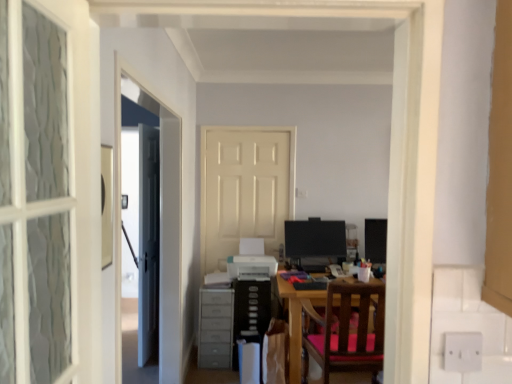
Question: Do you think wooden chair with pink cushion at center is within matte black monitor at right, which is counted as the 1th computer monitor, starting from the right, or outside of it?

Choices:
 (A) inside
 (B) outside

Answer: (B)

Question: From a real-world perspective, is wooden chair with pink cushion at center positioned above or below matte black monitor at right, placed as the second computer monitor when sorted from left to right?

Choices:
 (A) below
 (B) above

Answer: (A)

Question: Which is farther from the matte black monitor at center, arranged as the first computer monitor when viewed from the left?

Choices:
 (A) gray plastic dresser at lower left
 (B) white matte door at center, the second door from the front
 (C) white glossy printer at center
 (D) wooden chair with pink cushion at center
 (E) white glossy door at center, the 2th door from the right

Answer: (E)

Question: Estimate the real-world distances between objects in this image. Which object is farther from the wooden chair with pink cushion at center?

Choices:
 (A) gray plastic dresser at lower left
 (B) white glossy printer at center
 (C) white glossy door at center, the 1th door positioned from the left
 (D) matte black monitor at center, arranged as the first computer monitor when viewed from the left
 (E) white matte door at center, the second door from the front

Answer: (C)